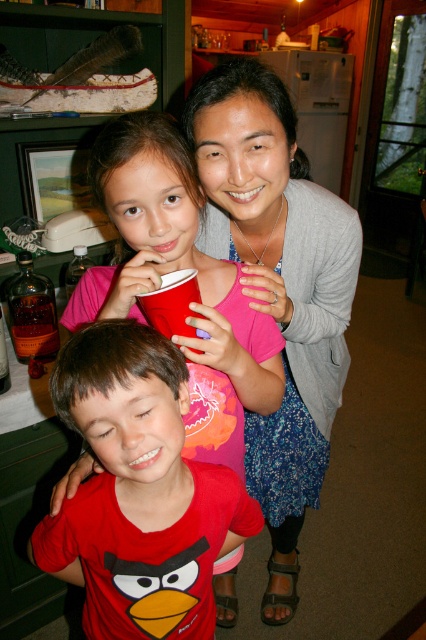
Which is more to the left, red matte angry bird shirt at lower left or brown glass bottle at lower left?

brown glass bottle at lower left

Who is lower down, red matte angry bird shirt at lower left or brown glass bottle at lower left?

Positioned lower is red matte angry bird shirt at lower left.

Where is `red matte angry bird shirt at lower left`? This screenshot has height=640, width=426. red matte angry bird shirt at lower left is located at coordinates (138, 492).

The width and height of the screenshot is (426, 640). I want to click on red matte angry bird shirt at lower left, so click(138, 492).

Between gray knit sweater at upper center and red matte angry bird shirt at lower left, which one appears on the left side from the viewer's perspective?

red matte angry bird shirt at lower left

Can you confirm if gray knit sweater at upper center is taller than red matte angry bird shirt at lower left?

Indeed, gray knit sweater at upper center has a greater height compared to red matte angry bird shirt at lower left.

Does point (236, 122) lie in front of point (36, 563)?

Yes, point (236, 122) is closer to viewer.

Image resolution: width=426 pixels, height=640 pixels. I want to click on gray knit sweater at upper center, so click(x=278, y=289).

Is point (301, 440) positioned behind point (45, 352)?

No, it is not.

Who is higher up, gray knit sweater at upper center or brown glass bottle at lower left?

Positioned higher is brown glass bottle at lower left.

Is point (282, 609) farther from camera compared to point (42, 349)?

That is True.

Locate an element on the screen. This screenshot has height=640, width=426. gray knit sweater at upper center is located at coordinates (278, 289).